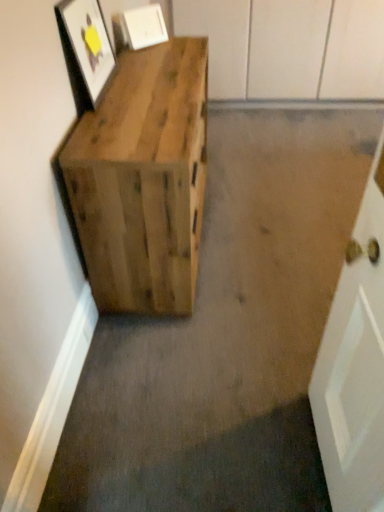
What is the approximate height of matte wooden picture frame at upper left, which is the 2th picture frame in back-to-front order?

matte wooden picture frame at upper left, which is the 2th picture frame in back-to-front order, is 38.55 centimeters in height.

The image size is (384, 512). Describe the element at coordinates (143, 180) in the screenshot. I see `natural wood crate at left` at that location.

The width and height of the screenshot is (384, 512). I want to click on natural wood crate at left, so click(143, 180).

This screenshot has height=512, width=384. Find the location of `matte wooden picture frame at upper left, which is the 2th picture frame in back-to-front order`. matte wooden picture frame at upper left, which is the 2th picture frame in back-to-front order is located at coordinates (85, 49).

The height and width of the screenshot is (512, 384). What are the coordinates of `furniture that appears in front of the matte white picture frame at upper center, placed as the 2th picture frame when sorted from front to back` in the screenshot? It's located at (143, 180).

What's the angular difference between natural wood crate at left and matte white picture frame at upper center, placed as the 2th picture frame when sorted from front to back,'s facing directions?

They differ by 44.2 degrees in their facing directions.

Could you tell me if natural wood crate at left is turned towards matte white picture frame at upper center, the first picture frame viewed from the back?

No, natural wood crate at left is not oriented towards matte white picture frame at upper center, the first picture frame viewed from the back.

Does point (139, 20) come farther from viewer compared to point (93, 71)?

Yes, point (139, 20) is behind point (93, 71).

Is matte white picture frame at upper center, the first picture frame viewed from the back, not near matte wooden picture frame at upper left, positioned as the first picture frame in front-to-back order?

Actually, matte white picture frame at upper center, the first picture frame viewed from the back, and matte wooden picture frame at upper left, positioned as the first picture frame in front-to-back order, are a little close together.

Which object is positioned more to the left, matte white picture frame at upper center, placed as the 2th picture frame when sorted from front to back, or matte wooden picture frame at upper left, positioned as the first picture frame in front-to-back order?

matte wooden picture frame at upper left, positioned as the first picture frame in front-to-back order, is more to the left.

Based on their sizes in the image, would you say matte white picture frame at upper center, placed as the 2th picture frame when sorted from front to back, is bigger or smaller than matte wooden picture frame at upper left, which is the 2th picture frame in back-to-front order?

Considering their sizes, matte white picture frame at upper center, placed as the 2th picture frame when sorted from front to back, takes up less space than matte wooden picture frame at upper left, which is the 2th picture frame in back-to-front order.

Locate an element on the screen. The width and height of the screenshot is (384, 512). picture frame that is the 2nd object located above the natural wood crate at left (from the image's perspective) is located at coordinates (144, 26).

From the image's perspective, would you say matte white picture frame at upper center, the first picture frame viewed from the back, is positioned over natural wood crate at left?

Yes, from the image's perspective, matte white picture frame at upper center, the first picture frame viewed from the back, is above natural wood crate at left.

Considering the sizes of objects matte white picture frame at upper center, the first picture frame viewed from the back, and natural wood crate at left in the image provided, who is thinner, matte white picture frame at upper center, the first picture frame viewed from the back, or natural wood crate at left?

With smaller width is matte white picture frame at upper center, the first picture frame viewed from the back.

Is matte white picture frame at upper center, placed as the 2th picture frame when sorted from front to back, inside the boundaries of natural wood crate at left, or outside?

matte white picture frame at upper center, placed as the 2th picture frame when sorted from front to back, is not inside natural wood crate at left, it's outside.

Could you tell me if natural wood crate at left is turned towards matte wooden picture frame at upper left, which is the 2th picture frame in back-to-front order?

No, natural wood crate at left is not turned towards matte wooden picture frame at upper left, which is the 2th picture frame in back-to-front order.

Can you see natural wood crate at left touching matte wooden picture frame at upper left, positioned as the first picture frame in front-to-back order?

natural wood crate at left and matte wooden picture frame at upper left, positioned as the first picture frame in front-to-back order, are not in contact.

From a real-world perspective, between natural wood crate at left and matte wooden picture frame at upper left, which is the 2th picture frame in back-to-front order, who is vertically higher?

matte wooden picture frame at upper left, which is the 2th picture frame in back-to-front order, from a real-world perspective.

Can you tell me how much natural wood crate at left and matte wooden picture frame at upper left, which is the 2th picture frame in back-to-front order, differ in facing direction?

0.821 degrees separate the facing orientations of natural wood crate at left and matte wooden picture frame at upper left, which is the 2th picture frame in back-to-front order.

Based on the photo, could matte white picture frame at upper center, the first picture frame viewed from the back, be considered to be inside matte wooden picture frame at upper left, which is the 2th picture frame in back-to-front order?

No, matte wooden picture frame at upper left, which is the 2th picture frame in back-to-front order, does not contain matte white picture frame at upper center, the first picture frame viewed from the back.

From a real-world perspective, relative to matte white picture frame at upper center, placed as the 2th picture frame when sorted from front to back, is matte wooden picture frame at upper left, which is the 2th picture frame in back-to-front order, vertically above or below?

In terms of real-world spatial position, matte wooden picture frame at upper left, which is the 2th picture frame in back-to-front order, is above matte white picture frame at upper center, placed as the 2th picture frame when sorted from front to back.

Is matte wooden picture frame at upper left, which is the 2th picture frame in back-to-front order, far away from matte white picture frame at upper center, the first picture frame viewed from the back?

No, matte wooden picture frame at upper left, which is the 2th picture frame in back-to-front order, is in close proximity to matte white picture frame at upper center, the first picture frame viewed from the back.

Is matte wooden picture frame at upper left, which is the 2th picture frame in back-to-front order, taller than matte white picture frame at upper center, placed as the 2th picture frame when sorted from front to back?

Correct, matte wooden picture frame at upper left, which is the 2th picture frame in back-to-front order, is much taller as matte white picture frame at upper center, placed as the 2th picture frame when sorted from front to back.

Does matte wooden picture frame at upper left, which is the 2th picture frame in back-to-front order, touch natural wood crate at left?

No, matte wooden picture frame at upper left, which is the 2th picture frame in back-to-front order, is not with natural wood crate at left.

What's the angular difference between matte wooden picture frame at upper left, which is the 2th picture frame in back-to-front order, and natural wood crate at left's facing directions?

0.821 degrees.

From a real-world perspective, is matte wooden picture frame at upper left, positioned as the first picture frame in front-to-back order, located higher than natural wood crate at left?

Yes.

In terms of width, does matte wooden picture frame at upper left, positioned as the first picture frame in front-to-back order, look wider or thinner when compared to natural wood crate at left?

Clearly, matte wooden picture frame at upper left, positioned as the first picture frame in front-to-back order, has less width compared to natural wood crate at left.

Find the location of a particular element. This screenshot has height=512, width=384. furniture that is in front of the matte white picture frame at upper center, placed as the 2th picture frame when sorted from front to back is located at coordinates (143, 180).

Where is `picture frame on the left of matte white picture frame at upper center, placed as the 2th picture frame when sorted from front to back`? picture frame on the left of matte white picture frame at upper center, placed as the 2th picture frame when sorted from front to back is located at coordinates (85, 49).

Which object lies nearer to the anchor point matte wooden picture frame at upper left, which is the 2th picture frame in back-to-front order, matte white picture frame at upper center, placed as the 2th picture frame when sorted from front to back, or natural wood crate at left?

natural wood crate at left.

Based on their spatial positions, is natural wood crate at left or matte white picture frame at upper center, placed as the 2th picture frame when sorted from front to back, further from matte wooden picture frame at upper left, which is the 2th picture frame in back-to-front order?

matte white picture frame at upper center, placed as the 2th picture frame when sorted from front to back, lies further to matte wooden picture frame at upper left, which is the 2th picture frame in back-to-front order, than the other object.

Looking at this image, looking at the image, which one is located closer to natural wood crate at left, matte white picture frame at upper center, placed as the 2th picture frame when sorted from front to back, or matte wooden picture frame at upper left, positioned as the first picture frame in front-to-back order?

matte wooden picture frame at upper left, positioned as the first picture frame in front-to-back order, is positioned closer to the anchor natural wood crate at left.

When comparing their distances from matte white picture frame at upper center, placed as the 2th picture frame when sorted from front to back, does matte wooden picture frame at upper left, positioned as the first picture frame in front-to-back order, or natural wood crate at left seem closer?

Among the two, matte wooden picture frame at upper left, positioned as the first picture frame in front-to-back order, is located nearer to matte white picture frame at upper center, placed as the 2th picture frame when sorted from front to back.

Based on the photo, which object lies nearer to the anchor point natural wood crate at left, matte wooden picture frame at upper left, positioned as the first picture frame in front-to-back order, or matte white picture frame at upper center, the first picture frame viewed from the back?

matte wooden picture frame at upper left, positioned as the first picture frame in front-to-back order, is closer to natural wood crate at left.

Estimate the real-world distances between objects in this image. Which object is further from matte white picture frame at upper center, the first picture frame viewed from the back, natural wood crate at left or matte wooden picture frame at upper left, positioned as the first picture frame in front-to-back order?

natural wood crate at left is positioned further to the anchor matte white picture frame at upper center, the first picture frame viewed from the back.

The width and height of the screenshot is (384, 512). Identify the location of picture frame located between natural wood crate at left and matte white picture frame at upper center, the first picture frame viewed from the back, in the depth direction. (85, 49).